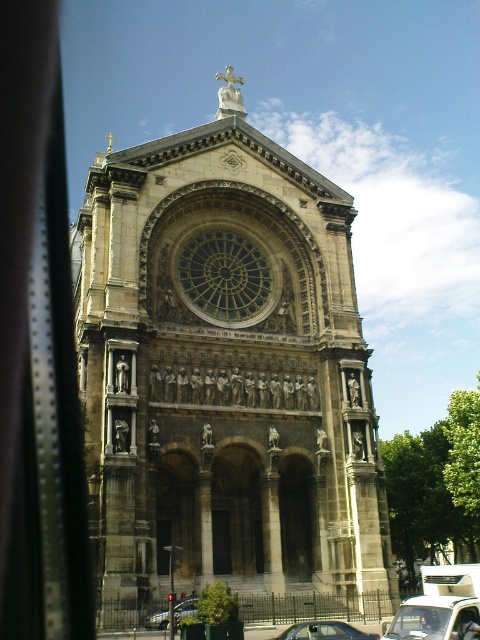
Between golden glass rose window at center and silver metallic car at lower center, which one appears on the left side from the viewer's perspective?

golden glass rose window at center is more to the left.

The width and height of the screenshot is (480, 640). Identify the location of golden glass rose window at center. (226, 275).

Does silver metallic car at lower center have a lesser width compared to metallic silver car at lower left?

No.

Identify the location of silver metallic car at lower center. The image size is (480, 640). (324, 632).

Identify the location of silver metallic car at lower center. (324, 632).

Is golden glass rose window at center shorter than transparent glass car window at lower right?

No, golden glass rose window at center is not shorter than transparent glass car window at lower right.

Between golden glass rose window at center and transparent glass car window at lower right, which one is positioned higher?

golden glass rose window at center is higher up.

The width and height of the screenshot is (480, 640). What are the coordinates of `golden glass rose window at center` in the screenshot? It's located at (226, 275).